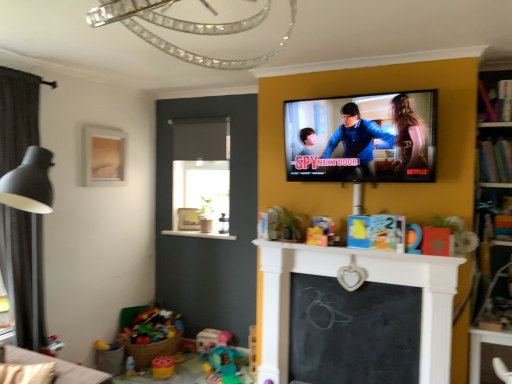
Locate an element on the screen. free location above black chalkboard at center (from a real-world perspective) is located at coordinates (366, 280).